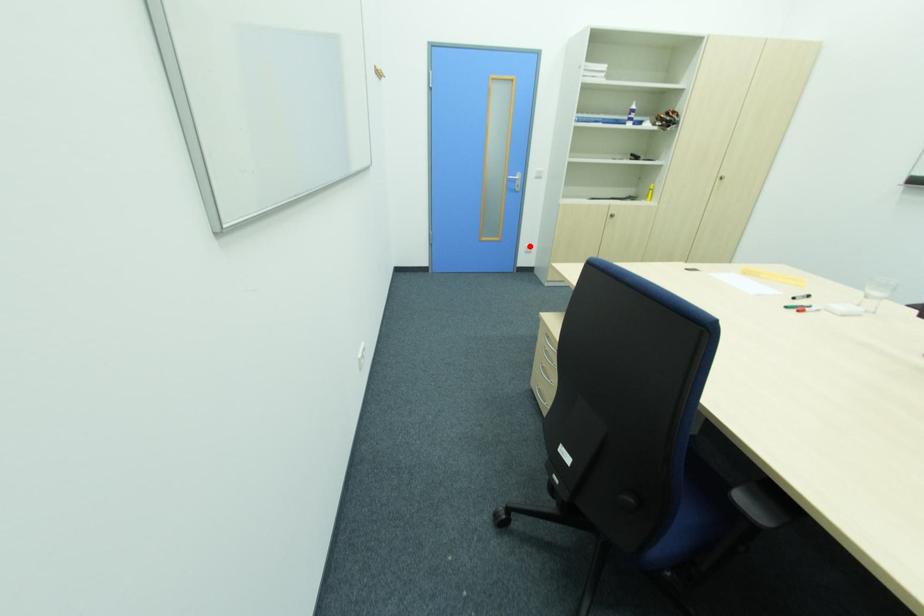
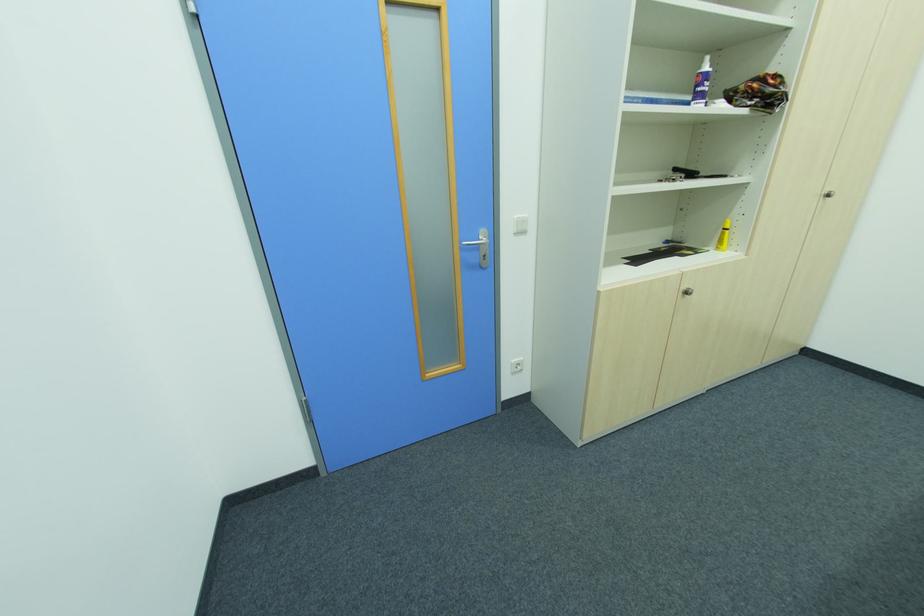
Locate, in the second image, the point that corresponds to the highlighted location in the first image.

(516, 362)